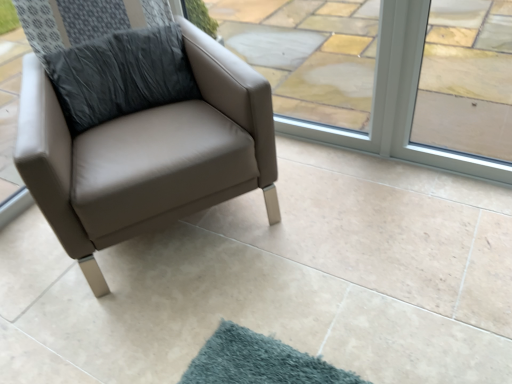
The width and height of the screenshot is (512, 384). What are the coordinates of `matte leather armchair at left` in the screenshot? It's located at (147, 155).

The image size is (512, 384). Describe the element at coordinates (147, 155) in the screenshot. I see `matte leather armchair at left` at that location.

This screenshot has width=512, height=384. In order to click on matte leather armchair at left in this screenshot , I will do `click(147, 155)`.